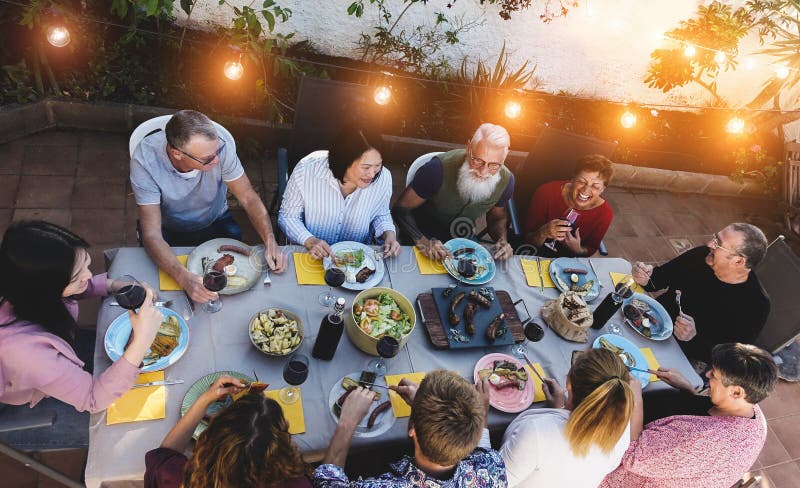
This screenshot has width=800, height=488. I want to click on silverware that's in use, so click(377, 385), click(246, 386), click(382, 254), click(454, 257), click(494, 252), click(680, 299), click(652, 285), click(636, 368), click(537, 371).